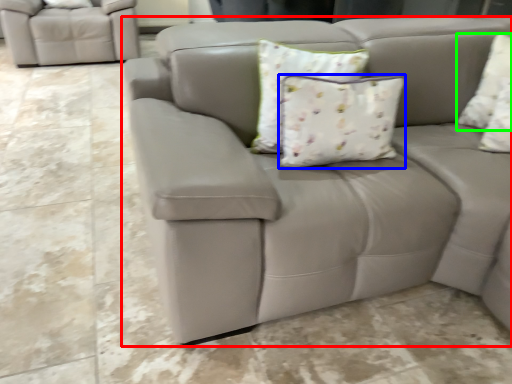
Question: Considering the real-world distances, which object is farthest from studio couch (highlighted by a red box)? pillow (highlighted by a blue box) or pillow (highlighted by a green box)?

Choices:
 (A) pillow
 (B) pillow

Answer: (B)